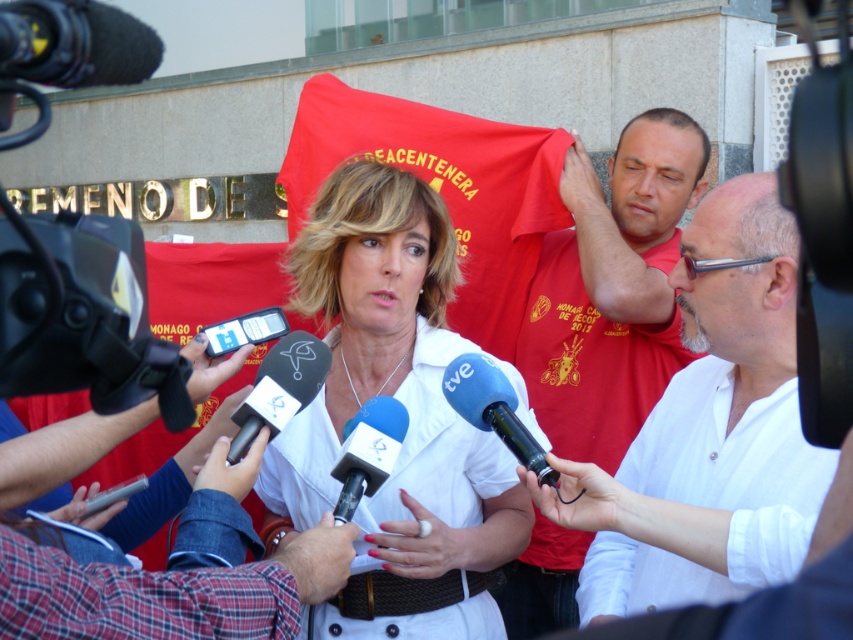
Question: Does black plastic microphone at center appear on the left side of blue rubber microphone at center?

Choices:
 (A) yes
 (B) no

Answer: (A)

Question: Among these objects, which one is nearest to the camera?

Choices:
 (A) matte red shirt at center
 (B) blue rubberized microphone at center
 (C) black plastic media at center
 (D) black plastic microphone at center

Answer: (D)

Question: Which object is positioned farthest from the black plastic microphone at center?

Choices:
 (A) blue rubberized microphone at center
 (B) white matte shirt at center
 (C) red fabric flag at center
 (D) black plastic media at center

Answer: (C)

Question: Which of these objects is positioned farthest from the black plastic microphone at center?

Choices:
 (A) red fabric flag at center
 (B) blue rubber microphone at center

Answer: (A)

Question: Considering the relative positions of matte red shirt at center and blue rubber microphone at center in the image provided, where is matte red shirt at center located with respect to blue rubber microphone at center?

Choices:
 (A) left
 (B) right

Answer: (B)

Question: Can you confirm if blue rubber microphone at center is bigger than black plastic media at center?

Choices:
 (A) yes
 (B) no

Answer: (A)